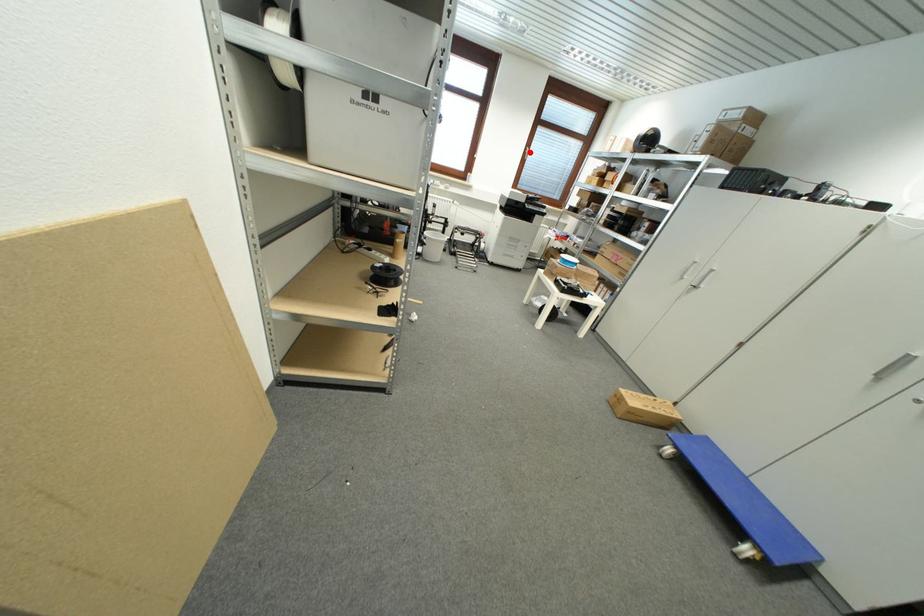
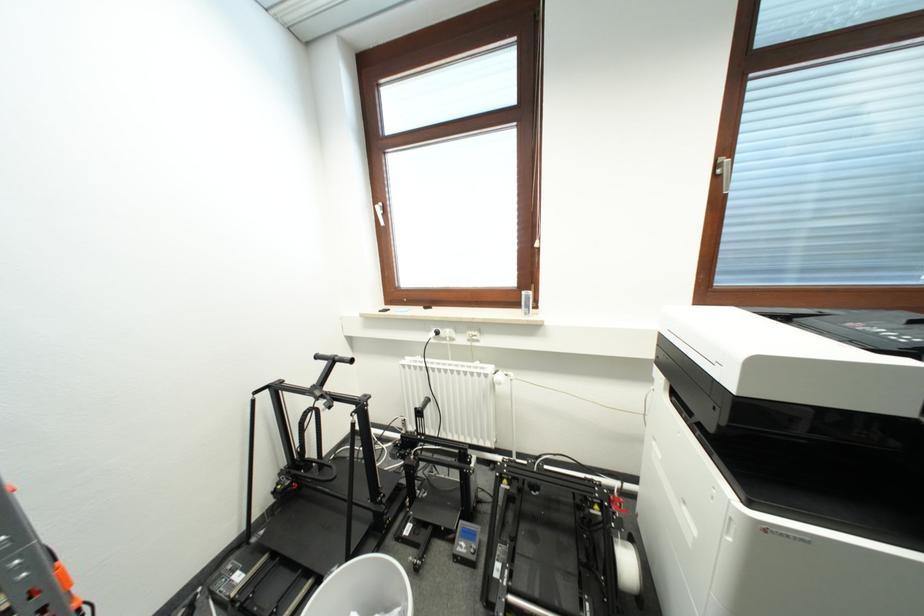
Question: I am providing you with two images of the same scene from different viewpoints. In image1, a red point is highlighted. Considering the same 3D point in image2, which of the following is correct?

Choices:
 (A) It is closer
 (B) It is farther

Answer: (B)